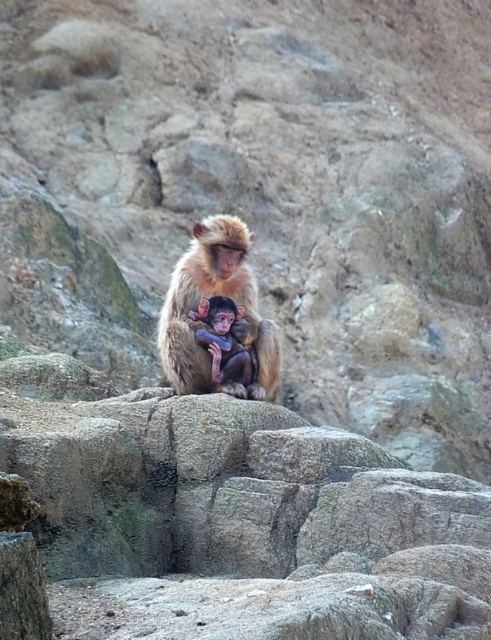
You are a wildlife photographer aiming to capture a closeup shot of both the furry brown monkey at center and the soft brown fur monkey at center. Given that your camera lens has a 30cm focal range, can you fit both monkeys into the frame without zooming out?

The furry brown monkey at center is wider than the soft brown fur monkey at center. However, without knowing the exact distance or the total width of both monkeys combined, it is impossible to determine if they can fit within the 30cm focal range. Additional measurements are needed.

You are a wildlife photographer aiming to capture a closeup shot of the monkeys. You have a lens that can focus on objects within 2 meters. The distance between the furry brown monkey at center and the soft brown fur monkey at center is 0.5 meters. Can you focus on both monkeys simultaneously with your current lens?

The distance between the furry brown monkey at center and the soft brown fur monkey at center is 0.5 meters. Since your lens can focus on objects within 2 meters, both monkeys are within the focus range. However, focusing on both simultaneously may depend on the lens depth of field. If the depth of field is sufficient to cover the 0.5 meters separation, then yes. Otherwise, you might need to adjust focus or use a different lens.

You are a wildlife photographer aiming to capture a closeup shot of both the furry brown monkey at center and the soft brown fur monkey at center in the image. Your camera has a maximum focus range of 10 inches. Can you get both monkeys in focus without moving your camera?

The furry brown monkey at center is 10.51 inches from the soft brown fur monkey at center. Since the distance between them is greater than the camera maximum focus range of 10 inches, you cannot get both monkeys in focus without moving the camera.